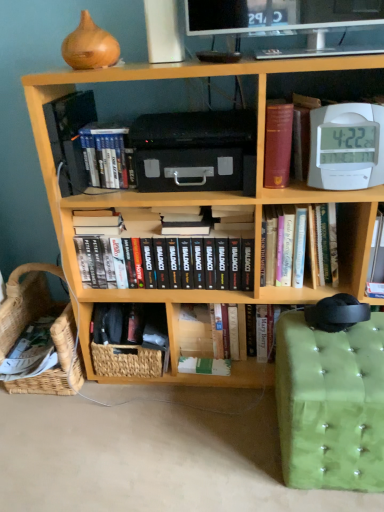
You are a GUI agent. You are given a task and a screenshot of the screen. Output one action in this format:
    pyautogui.click(x=<x>, y=<y>)
    Task: Click on the vacant region to the left of green tufted fabric swivel chair at lower right
    The image size is (384, 512).
    Given the screenshot: What is the action you would take?
    pyautogui.click(x=233, y=442)